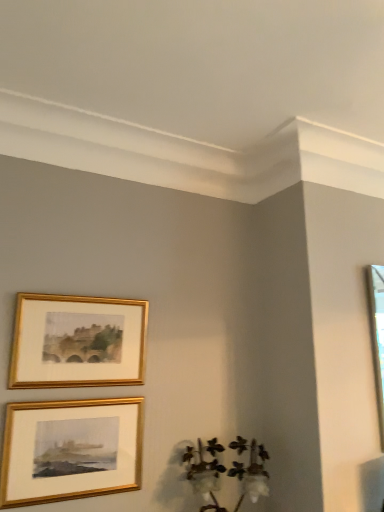
Question: Is gold/gilded picture frame at upper left, placed as the 1th picture frame when sorted from top to bottom, bigger or smaller than gold/glossy picture frame at lower left, which appears as the second picture frame when viewed from the top?

Choices:
 (A) small
 (B) big

Answer: (B)

Question: Is gold/gilded picture frame at upper left, placed as the 1th picture frame when sorted from top to bottom, inside the boundaries of gold/glossy picture frame at lower left, which appears as the second picture frame when viewed from the top, or outside?

Choices:
 (A) outside
 (B) inside

Answer: (A)

Question: Which of these objects is positioned closest to the gold/glossy picture frame at lower left, which appears as the second picture frame when viewed from the top?

Choices:
 (A) white cotton at lower right
 (B) gold/gilded picture frame at upper left, placed as the 1th picture frame when sorted from top to bottom

Answer: (B)

Question: Which object is the closest to the white cotton at lower right?

Choices:
 (A) gold/glossy picture frame at lower left, positioned as the 1th picture frame in bottom-to-top order
 (B) gold/gilded picture frame at upper left, placed as the 1th picture frame when sorted from top to bottom

Answer: (A)